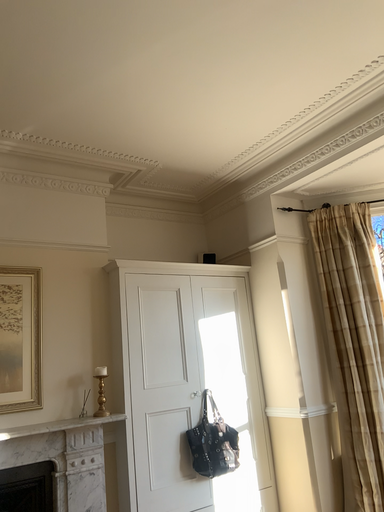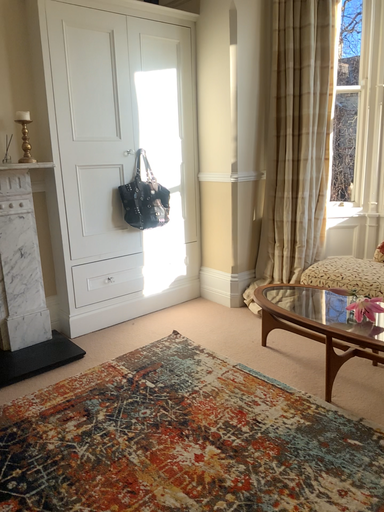
Question: How did the camera likely rotate when shooting the video?

Choices:
 (A) rotated downward
 (B) rotated upward

Answer: (A)